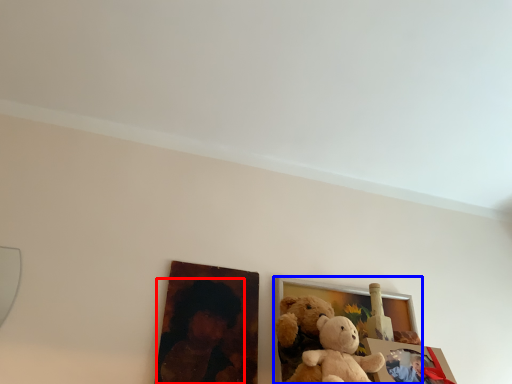
Question: Among these objects, which one is farthest to the camera, person (highlighted by a red box) or picture frame (highlighted by a blue box)?

Choices:
 (A) person
 (B) picture frame

Answer: (B)